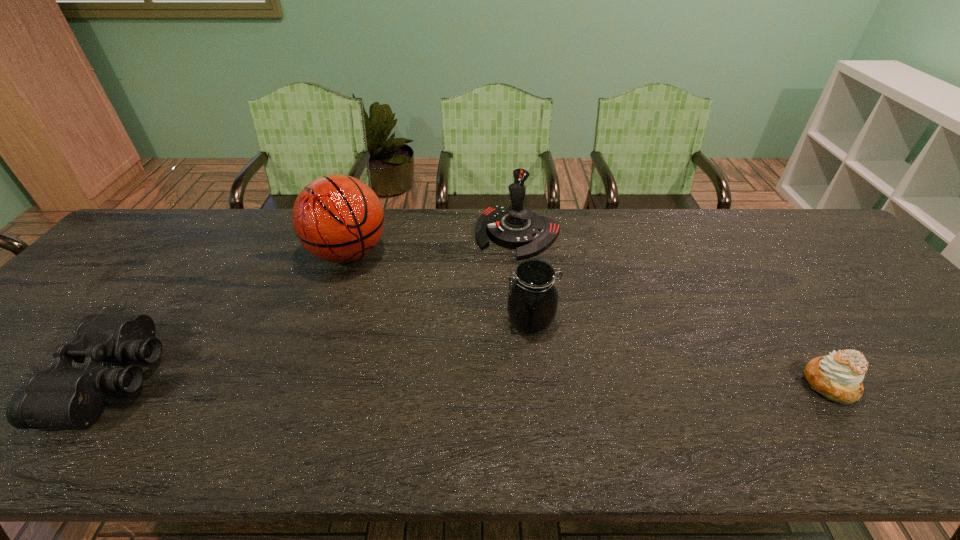
The width and height of the screenshot is (960, 540). I want to click on vacant point located 0.290m on the lid of the jar, so click(407, 389).

You are a GUI agent. You are given a task and a screenshot of the screen. Output one action in this format:
    pyautogui.click(x=<x>, y=<y>)
    Task: Click on the blank space located 0.210m on the lid of the jar
    Image resolution: width=960 pixels, height=540 pixels.
    Given the screenshot: What is the action you would take?
    pyautogui.click(x=438, y=372)

You are a GUI agent. You are given a task and a screenshot of the screen. Output one action in this format:
    pyautogui.click(x=<x>, y=<y>)
    Task: Click on the vacant space located on the lid of the jar
    
    Given the screenshot: What is the action you would take?
    pyautogui.click(x=430, y=376)

Locate an element on the screen. This screenshot has height=540, width=960. vacant area situated 0.170m on the side with spill of the tallest object is located at coordinates (387, 314).

Find the location of `vacant region located on the side with spill of the tallest object`. vacant region located on the side with spill of the tallest object is located at coordinates (385, 312).

Where is `free space located 0.180m on the side with spill of the tallest object`? This screenshot has width=960, height=540. free space located 0.180m on the side with spill of the tallest object is located at coordinates (389, 317).

Where is `vacant space located 0.050m on the handle side of the joystick`? The height and width of the screenshot is (540, 960). vacant space located 0.050m on the handle side of the joystick is located at coordinates 494,268.

Identify the location of free space located on the handle side of the joystick. (465, 312).

Image resolution: width=960 pixels, height=540 pixels. Identify the location of free space located on the handle side of the joystick. (489, 276).

Identify the location of basketball located at the far edge. This screenshot has height=540, width=960. (337, 218).